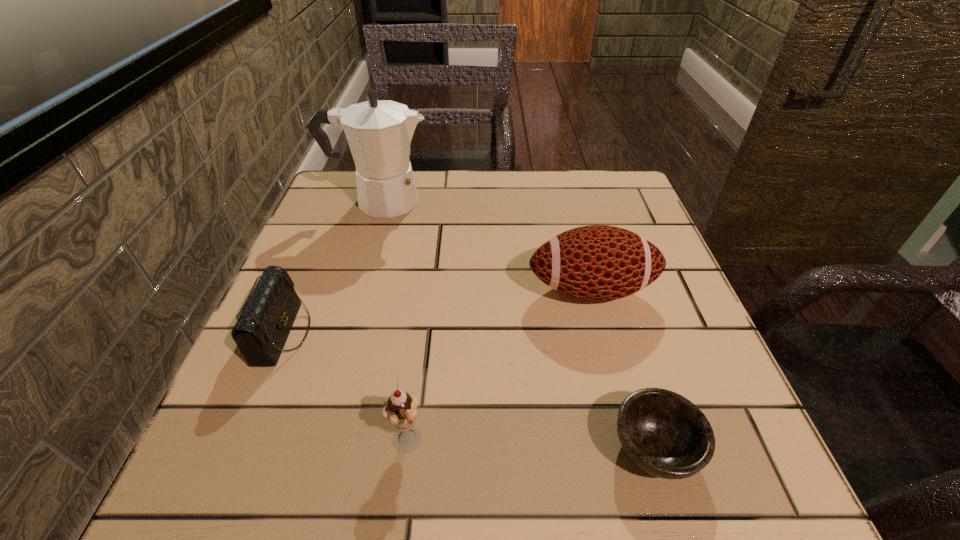
Where is `free spot at the far edge of the desktop`? The height and width of the screenshot is (540, 960). free spot at the far edge of the desktop is located at coordinates (534, 190).

Identify the location of vacant region at the near edge of the desktop. coord(532,492).

You are a GUI agent. You are given a task and a screenshot of the screen. Output one action in this format:
    pyautogui.click(x=<x>, y=<y>)
    Task: Click on the vacant space at the left edge
    This screenshot has width=960, height=540.
    Given the screenshot: What is the action you would take?
    pyautogui.click(x=318, y=370)

Where is `vacant space at the right edge of the desktop`? The height and width of the screenshot is (540, 960). vacant space at the right edge of the desktop is located at coordinates (649, 335).

Locate an element on the screen. vacant area at the far left corner of the desktop is located at coordinates (325, 195).

Find the location of a particular element. Image resolution: width=960 pixels, height=540 pixels. free space at the near left corner of the desktop is located at coordinates (294, 458).

Locate an element on the screen. The image size is (960, 540). vacant space at the far right corner of the desktop is located at coordinates (623, 171).

The image size is (960, 540). In the image, there is a desktop. In order to click on vacant space at the near right corner in this screenshot , I will do `click(737, 461)`.

Find the location of a particular element. The image size is (960, 540). free space that is in between the fourth tallest object and the icecream is located at coordinates (345, 388).

Locate an element on the screen. free space between the bowl and the icecream is located at coordinates (531, 445).